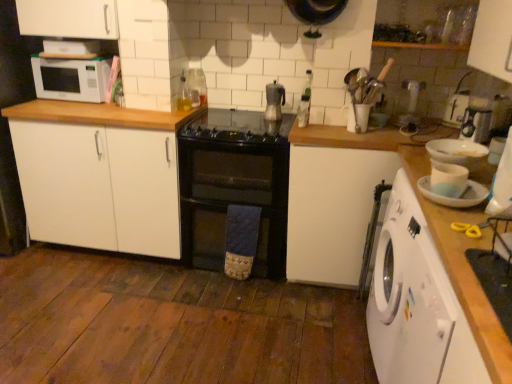
You are a GUI agent. You are given a task and a screenshot of the screen. Output one action in this format:
    pyautogui.click(x=<x>, y=<y>)
    Task: Click on the white matte countertop at right
    This screenshot has width=512, height=384.
    Given the screenshot: What is the action you would take?
    pyautogui.click(x=433, y=232)

The width and height of the screenshot is (512, 384). Describe the element at coordinates (433, 232) in the screenshot. I see `white matte countertop at right` at that location.

The height and width of the screenshot is (384, 512). What are the coordinates of `white matte cabinet at left` in the screenshot? It's located at (99, 175).

Measure the distance between clear glass bottle at upper center, the second appliance in the front-to-back sequence, and camera.

2.33 meters.

Locate an element on the screen. This screenshot has width=512, height=384. white glossy mug at upper right, placed as the 3th appliance when sorted from top to bottom is located at coordinates (455, 198).

What are the coordinates of `white matte countertop at right` in the screenshot? It's located at (433, 232).

In the scene shown: Is the position of black glass oven at center more distant than that of white matte microwave at upper left?

No, it is not.

I want to click on microwave oven on the left of the black glass oven at center, so click(71, 78).

Which of these two, black glass oven at center or white matte microwave at upper left, is smaller?

With smaller size is white matte microwave at upper left.

Does white plastic washing machine at right have a larger size compared to metallic silver coffee maker at center, acting as the 3th appliance starting from the bottom?

Correct, white plastic washing machine at right is larger in size than metallic silver coffee maker at center, acting as the 3th appliance starting from the bottom.

How far apart are white plastic washing machine at right and metallic silver coffee maker at center, the third appliance positioned from the front?

They are 1.40 meters apart.

Which is in front, point (443, 361) or point (280, 102)?

The point (443, 361) is more forward.

Is white plastic washing machine at right positioned with its back to metallic silver coffee maker at center, which is the 1th appliance in back-to-front order?

No, white plastic washing machine at right is not facing away from metallic silver coffee maker at center, which is the 1th appliance in back-to-front order.

From the image's perspective, which is below, white plastic washing machine at right or clear glass bottle at upper center, acting as the second appliance starting from the left?

white plastic washing machine at right appears lower in the image.

Can you confirm if white plastic washing machine at right is taller than clear glass bottle at upper center, the 2th appliance when ordered from back to front?

Indeed, white plastic washing machine at right has a greater height compared to clear glass bottle at upper center, the 2th appliance when ordered from back to front.

Based on the photo, what's the angular difference between white plastic washing machine at right and clear glass bottle at upper center, the second appliance in the front-to-back sequence,'s facing directions?

The angular difference between white plastic washing machine at right and clear glass bottle at upper center, the second appliance in the front-to-back sequence, is 1.45 degrees.

Is white plastic washing machine at right to the right of clear glass bottle at upper center, the second appliance in the front-to-back sequence, from the viewer's perspective?

Yes, white plastic washing machine at right is to the right of clear glass bottle at upper center, the second appliance in the front-to-back sequence.

Could you tell me if white plastic washing machine at right is facing white glossy mug at upper right, arranged as the 1th appliance when ordered from the bottom?

No, white plastic washing machine at right is not aimed at white glossy mug at upper right, arranged as the 1th appliance when ordered from the bottom.

Is white plastic washing machine at right to the left of white glossy mug at upper right, arranged as the 1th appliance when ordered from the bottom, from the viewer's perspective?

Incorrect, white plastic washing machine at right is not on the left side of white glossy mug at upper right, arranged as the 1th appliance when ordered from the bottom.

Considering the sizes of objects white plastic washing machine at right and white glossy mug at upper right, placed as the 3th appliance when sorted from top to bottom, in the image provided, who is shorter, white plastic washing machine at right or white glossy mug at upper right, placed as the 3th appliance when sorted from top to bottom,?

Standing shorter between the two is white glossy mug at upper right, placed as the 3th appliance when sorted from top to bottom.

The width and height of the screenshot is (512, 384). I want to click on washing machine on the right of white glossy mug at upper right, the first appliance when ordered from front to back, so click(x=416, y=304).

Is black glass oven at center outside of white matte countertop at right?

Yes, black glass oven at center is located beyond the bounds of white matte countertop at right.

Between black glass oven at center and white matte countertop at right, which one has larger width?

black glass oven at center is wider.

Does black glass oven at center turn towards white matte countertop at right?

No, black glass oven at center is not turned towards white matte countertop at right.

Considering the relative sizes of black glass gas stove at center and black glass oven at center in the image provided, is black glass gas stove at center shorter than black glass oven at center?

Yes.

Is black glass gas stove at center positioned far away from black glass oven at center?

black glass gas stove at center is near black glass oven at center, not far away.

How different are the orientations of black glass gas stove at center and black glass oven at center in degrees?

They differ by 0.000226 degrees in their facing directions.

Considering the relative sizes of black glass gas stove at center and black glass oven at center in the image provided, is black glass gas stove at center smaller than black glass oven at center?

Correct, black glass gas stove at center occupies less space than black glass oven at center.

Is metallic silver coffee maker at center, positioned as the 1th appliance in left-to-right order, with white plastic washing machine at right?

metallic silver coffee maker at center, positioned as the 1th appliance in left-to-right order, and white plastic washing machine at right are not in contact.

From a real-world perspective, between metallic silver coffee maker at center, marked as the third appliance in a right-to-left arrangement, and white plastic washing machine at right, who is vertically lower?

white plastic washing machine at right is physically lower.

Is metallic silver coffee maker at center, arranged as the 1th appliance when viewed from the top, at the left side of white plastic washing machine at right?

Correct, you'll find metallic silver coffee maker at center, arranged as the 1th appliance when viewed from the top, to the left of white plastic washing machine at right.

In terms of height, does metallic silver coffee maker at center, marked as the third appliance in a right-to-left arrangement, look taller or shorter compared to white plastic washing machine at right?

Clearly, metallic silver coffee maker at center, marked as the third appliance in a right-to-left arrangement, is shorter compared to white plastic washing machine at right.

The image size is (512, 384). Identify the location of microwave oven located above the black glass oven at center (from the image's perspective). (71, 78).

Identify the location of washing machine below the metallic silver coffee maker at center, the third appliance positioned from the front (from the image's perspective). (416, 304).

Estimate the real-world distances between objects in this image. Which object is further from white glossy mug at upper right, which is counted as the 3th appliance, starting from the left, clear glass bottle at upper center, acting as the second appliance starting from the left, or metallic silver coffee maker at center, acting as the 3th appliance starting from the bottom?

Among the two, metallic silver coffee maker at center, acting as the 3th appliance starting from the bottom, is located further to white glossy mug at upper right, which is counted as the 3th appliance, starting from the left.

Estimate the real-world distances between objects in this image. Which object is further from black glass gas stove at center, white plastic washing machine at right or white matte countertop at right?

Based on the image, white plastic washing machine at right appears to be further to black glass gas stove at center.

When comparing their distances from black glass oven at center, does white matte cabinet at left or white plastic washing machine at right seem closer?

white matte cabinet at left.

Which object lies further to the anchor point white matte cabinet at left, white plastic washing machine at right or black glass gas stove at center?

white plastic washing machine at right.

Looking at this image, considering their positions, is black glass gas stove at center positioned closer to white glossy mug at upper right, placed as the 3th appliance when sorted from top to bottom, than white matte cabinet at left?

black glass gas stove at center.

From the image, which object appears to be nearer to black glass oven at center, metallic silver coffee maker at center, arranged as the 1th appliance when viewed from the top, or white matte countertop at right?

Based on the image, metallic silver coffee maker at center, arranged as the 1th appliance when viewed from the top, appears to be nearer to black glass oven at center.

Which object lies nearer to the anchor point white matte cabinet at left, white plastic washing machine at right or white matte microwave at upper left?

Among the two, white matte microwave at upper left is located nearer to white matte cabinet at left.

Based on their spatial positions, is clear glass bottle at upper center, the second appliance in the front-to-back sequence, or black glass gas stove at center further from white glossy mug at upper right, which is counted as the 3th appliance, starting from the left?

The object further to white glossy mug at upper right, which is counted as the 3th appliance, starting from the left, is black glass gas stove at center.

Find the location of a particular element. The width and height of the screenshot is (512, 384). appliance between white plastic washing machine at right and metallic silver coffee maker at center, acting as the 3th appliance starting from the bottom, along the z-axis is located at coordinates (304, 110).

Where is `appliance between white matte cabinet at left and clear glass bottle at upper center, which is the 2th appliance in right-to-left order, in the horizontal direction`? This screenshot has width=512, height=384. appliance between white matte cabinet at left and clear glass bottle at upper center, which is the 2th appliance in right-to-left order, in the horizontal direction is located at coordinates (274, 101).

The width and height of the screenshot is (512, 384). Find the location of `cabinetry located between white matte microwave at upper left and clear glass bottle at upper center, the 2th appliance when ordered from back to front, in the left-right direction`. cabinetry located between white matte microwave at upper left and clear glass bottle at upper center, the 2th appliance when ordered from back to front, in the left-right direction is located at coordinates (99, 175).

In order to click on countertop between black glass gas stove at center and white plastic washing machine at right from left to right in this screenshot , I will do `click(433, 232)`.